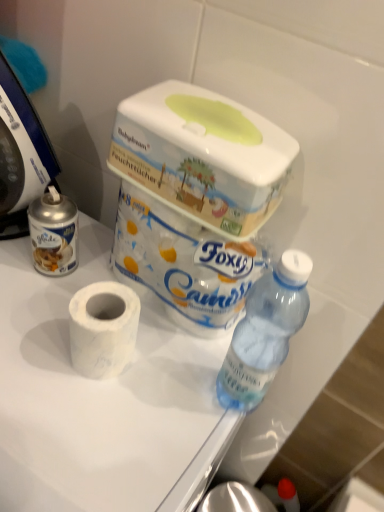
Question: Does white marble toilet paper at center, arranged as the second toilet paper when ordered from the bottom, have a greater height compared to white matte toilet paper at center?

Choices:
 (A) no
 (B) yes

Answer: (A)

Question: Is white marble toilet paper at center, arranged as the second toilet paper when ordered from the bottom, turned away from white matte toilet paper at center?

Choices:
 (A) yes
 (B) no

Answer: (B)

Question: Is white marble toilet paper at center, arranged as the second toilet paper when ordered from the bottom, not within white matte toilet paper at center?

Choices:
 (A) no
 (B) yes

Answer: (B)

Question: Does white marble toilet paper at center, arranged as the second toilet paper when ordered from the bottom, lie in front of white matte toilet paper at center?

Choices:
 (A) yes
 (B) no

Answer: (B)

Question: From a real-world perspective, is white marble toilet paper at center, which is the 1th toilet paper in top-to-bottom order, on white matte toilet paper at center?

Choices:
 (A) no
 (B) yes

Answer: (B)

Question: Is white marble toilet paper at center, arranged as the second toilet paper when ordered from the bottom, aimed at white matte toilet paper at center?

Choices:
 (A) no
 (B) yes

Answer: (A)

Question: Considering the relative sizes of blue plastic food processor at left and white marble toilet paper at center, which is the 1th toilet paper in top-to-bottom order, in the image provided, is blue plastic food processor at left bigger than white marble toilet paper at center, which is the 1th toilet paper in top-to-bottom order,?

Choices:
 (A) yes
 (B) no

Answer: (A)

Question: Is blue plastic food processor at left aimed at white marble toilet paper at center, which is the 1th toilet paper in top-to-bottom order?

Choices:
 (A) yes
 (B) no

Answer: (B)

Question: Can white marble toilet paper at center, which is the 1th toilet paper in top-to-bottom order, be found inside blue plastic food processor at left?

Choices:
 (A) no
 (B) yes

Answer: (A)

Question: From the image's perspective, does blue plastic food processor at left appear lower than white marble toilet paper at center, which is the 1th toilet paper in top-to-bottom order?

Choices:
 (A) no
 (B) yes

Answer: (A)

Question: Is blue plastic food processor at left smaller than white marble toilet paper at center, which is the 1th toilet paper in top-to-bottom order?

Choices:
 (A) yes
 (B) no

Answer: (B)

Question: Is blue plastic food processor at left completely or partially outside of white marble toilet paper at center, arranged as the second toilet paper when ordered from the bottom?

Choices:
 (A) no
 (B) yes

Answer: (B)

Question: Is white matte toilet paper at center, which ranks as the second toilet paper in top-to-bottom order, looking in the opposite direction of white marble toilet paper at center, which is the 1th toilet paper in top-to-bottom order?

Choices:
 (A) no
 (B) yes

Answer: (B)